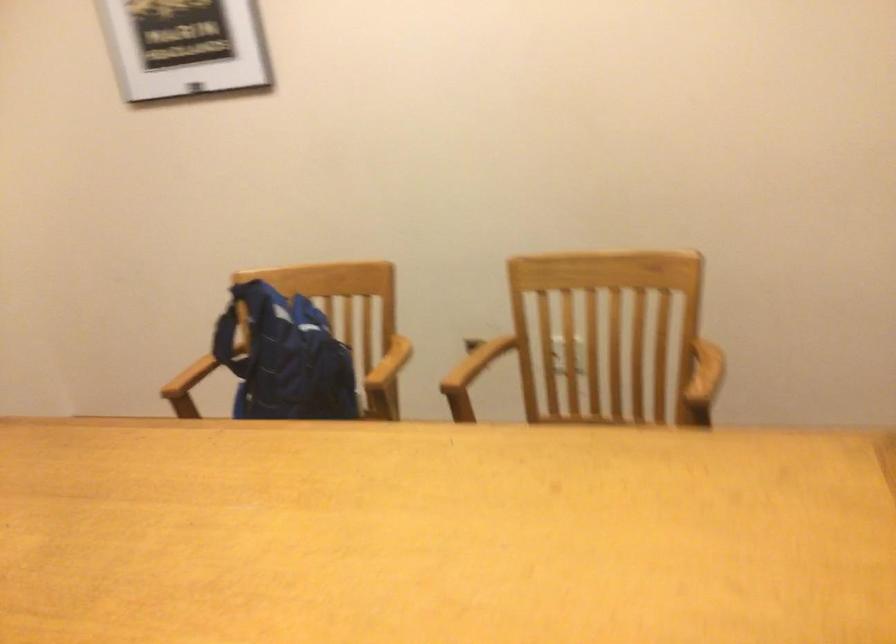
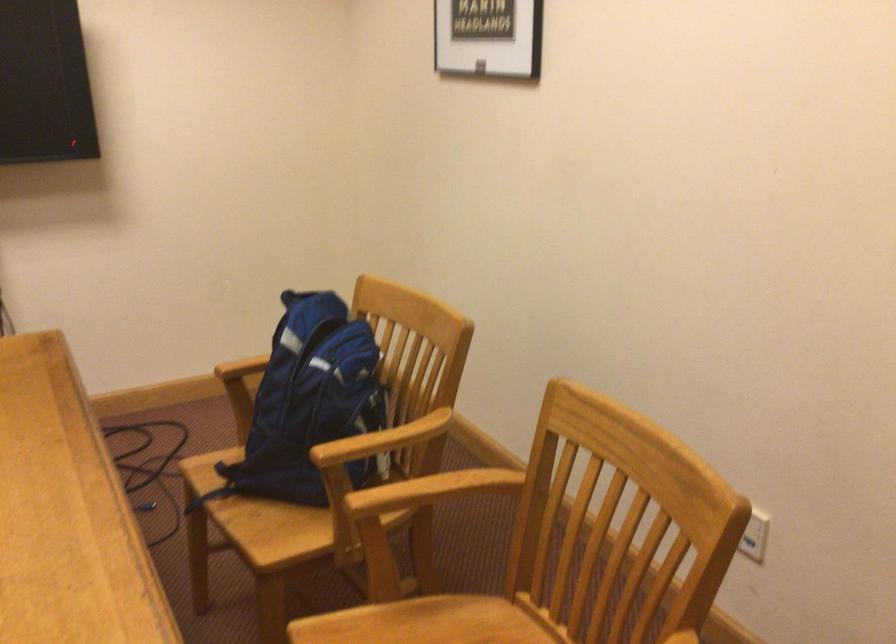
In the second image, find the point that corresponds to (x=177, y=381) in the first image.

(242, 368)